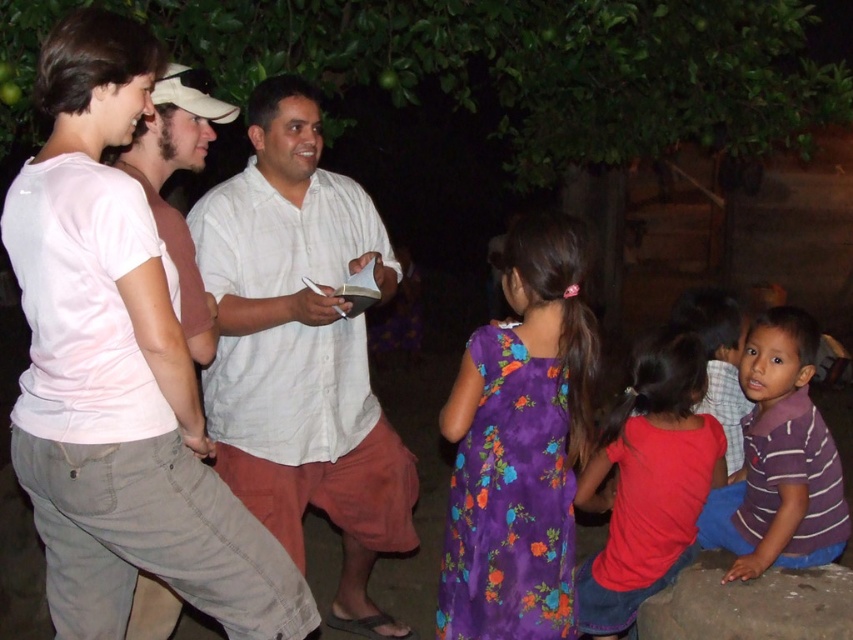
Does purple striped shirt at lower right have a greater height compared to pink cotton shirt at left?

Yes, purple striped shirt at lower right is taller than pink cotton shirt at left.

At what (x,y) coordinates should I click in order to perform the action: click on purple striped shirt at lower right. Please return your answer as a coordinate pair (x, y). Looking at the image, I should click on (779, 460).

Can you confirm if purple striped shirt at lower right is positioned below striped cotton shirt at center?

Yes, purple striped shirt at lower right is below striped cotton shirt at center.

Is point (737, 513) closer to viewer compared to point (717, 291)?

Yes, it is.

The height and width of the screenshot is (640, 853). Describe the element at coordinates (779, 460) in the screenshot. I see `purple striped shirt at lower right` at that location.

At what (x,y) coordinates should I click in order to perform the action: click on purple striped shirt at lower right. Please return your answer as a coordinate pair (x, y). The height and width of the screenshot is (640, 853). Looking at the image, I should click on tap(779, 460).

Which is below, purple floral dress at center or purple striped shirt at lower right?

purple striped shirt at lower right

Is point (491, 404) closer to viewer compared to point (762, 497)?

Yes, point (491, 404) is in front of point (762, 497).

I want to click on purple floral dress at center, so click(x=520, y=445).